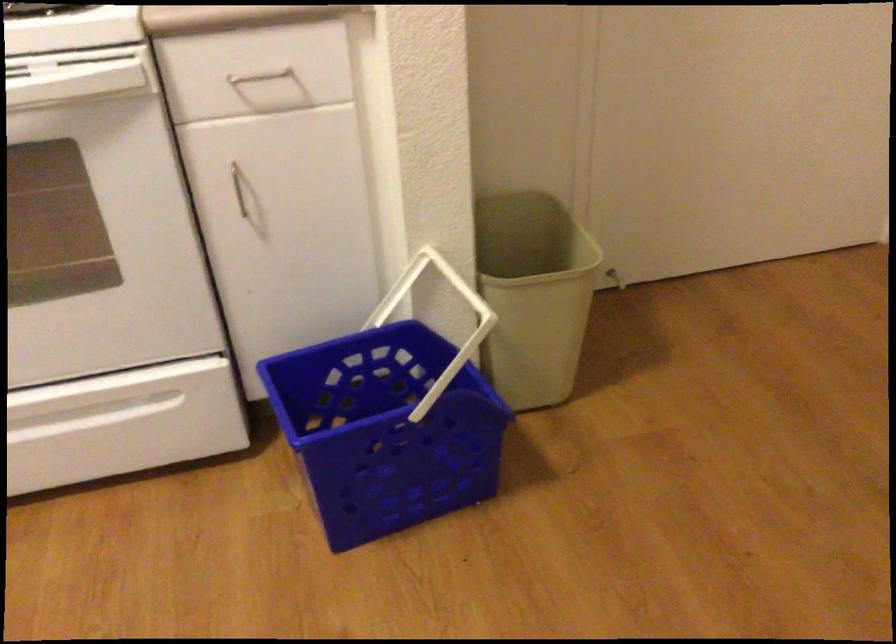
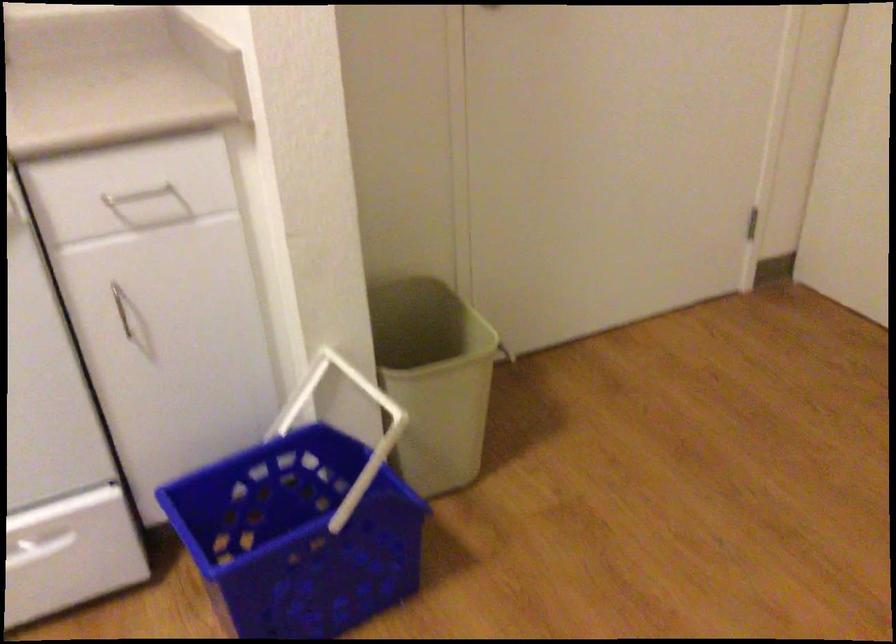
The point at (530, 290) is marked in the first image. Where is the corresponding point in the second image?

(434, 379)